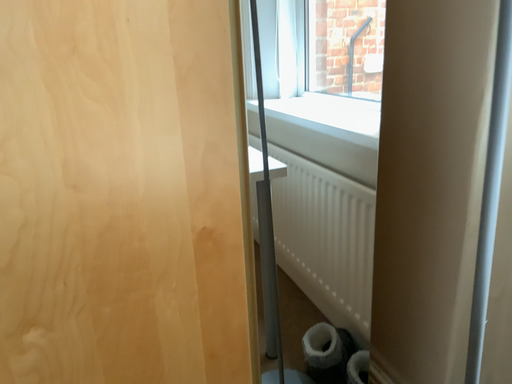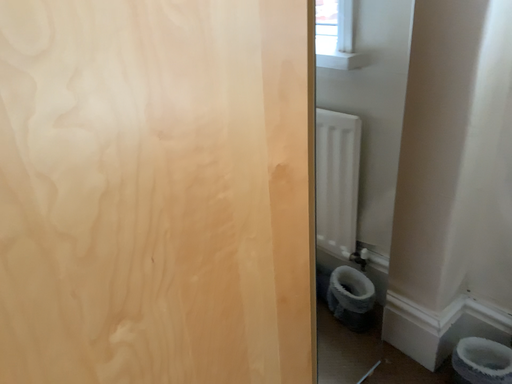
Question: How did the camera likely rotate when shooting the video?

Choices:
 (A) rotated left
 (B) rotated right

Answer: (B)